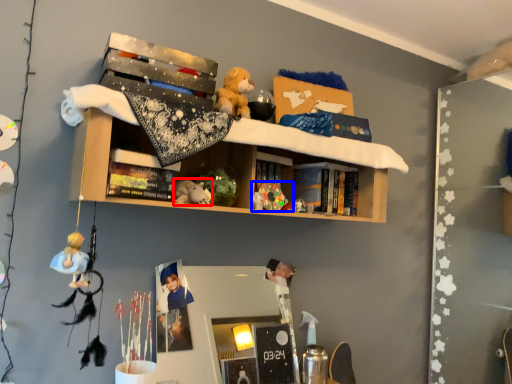
Question: Which point is closer to the camera, toy (highlighted by a red box) or toy (highlighted by a blue box)?

Choices:
 (A) toy
 (B) toy

Answer: (A)